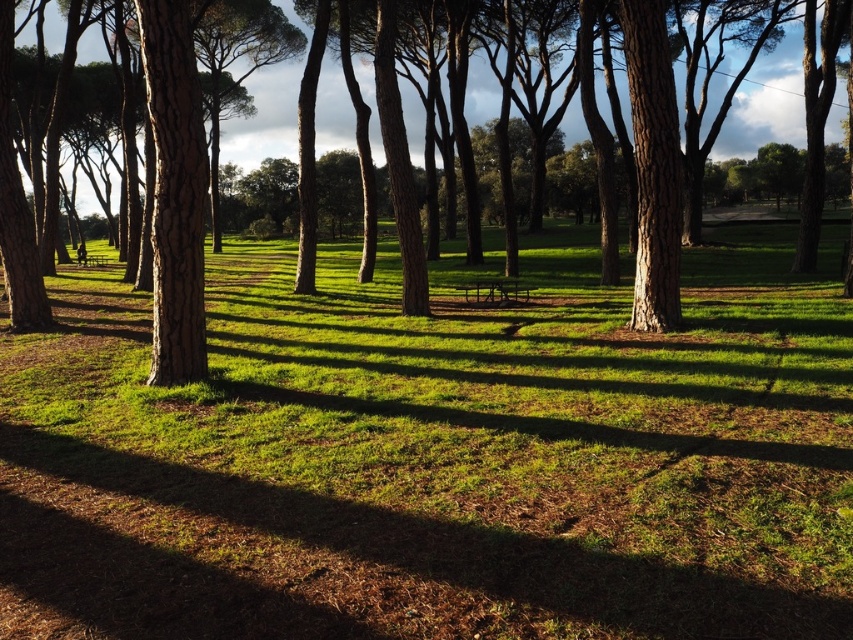
Question: Which point is farther to the camera?

Choices:
 (A) (618, 394)
 (B) (257, 80)

Answer: (B)

Question: Is green grassy at center to the right of brown rough tree at center from the viewer's perspective?

Choices:
 (A) yes
 (B) no

Answer: (B)

Question: Can you confirm if green grassy at center is thinner than brown rough tree at center?

Choices:
 (A) yes
 (B) no

Answer: (A)

Question: Which point is farther from the camera taking this photo?

Choices:
 (A) (339, 272)
 (B) (339, 90)

Answer: (B)

Question: Can you confirm if green grassy at center is thinner than brown rough tree at center?

Choices:
 (A) yes
 (B) no

Answer: (A)